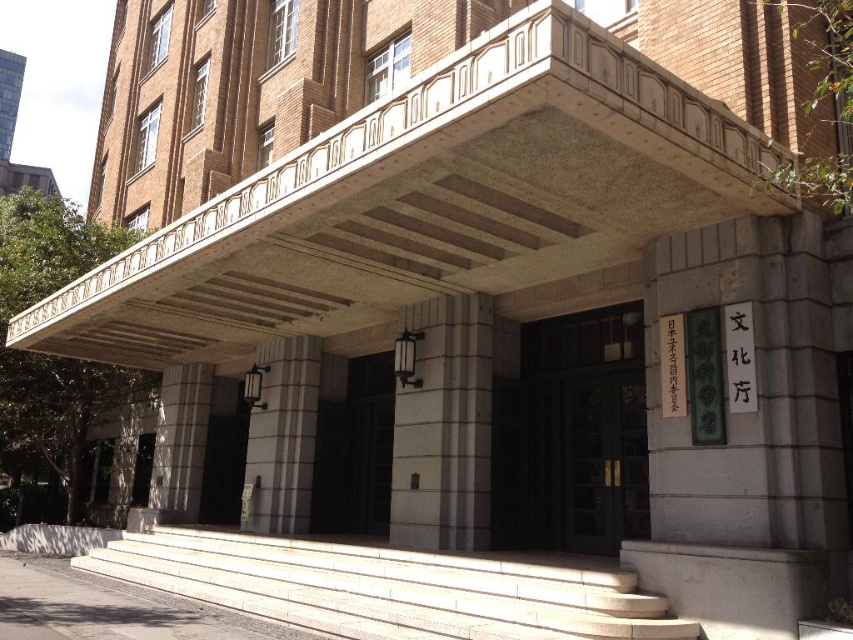
Looking at this image, is white stone stairs at center taller than white stone pillar at center?

No, white stone stairs at center is not taller than white stone pillar at center.

Based on the photo, does white stone stairs at center appear over white stone pillar at center?

Incorrect, white stone stairs at center is not positioned above white stone pillar at center.

Which is in front, point (647, 621) or point (431, 458)?

Positioned in front is point (647, 621).

Find the location of `white stone stairs at center`. white stone stairs at center is located at coordinates (390, 588).

Can you confirm if white stone stairs at center is taller than white stone column at center?

Incorrect, white stone stairs at center's height is not larger of white stone column at center's.

Does white stone stairs at center lie behind white stone column at center?

No, white stone stairs at center is closer to the viewer.

Between point (157, 566) and point (276, 378), which one is positioned behind?

Positioned behind is point (276, 378).

Find the location of a particular element. The image size is (853, 640). white stone stairs at center is located at coordinates (390, 588).

Is white stone pillar at center closer to camera compared to white stone column at center?

That is True.

Can you confirm if white stone pillar at center is thinner than white stone column at center?

No.

The height and width of the screenshot is (640, 853). Identify the location of white stone pillar at center. (444, 428).